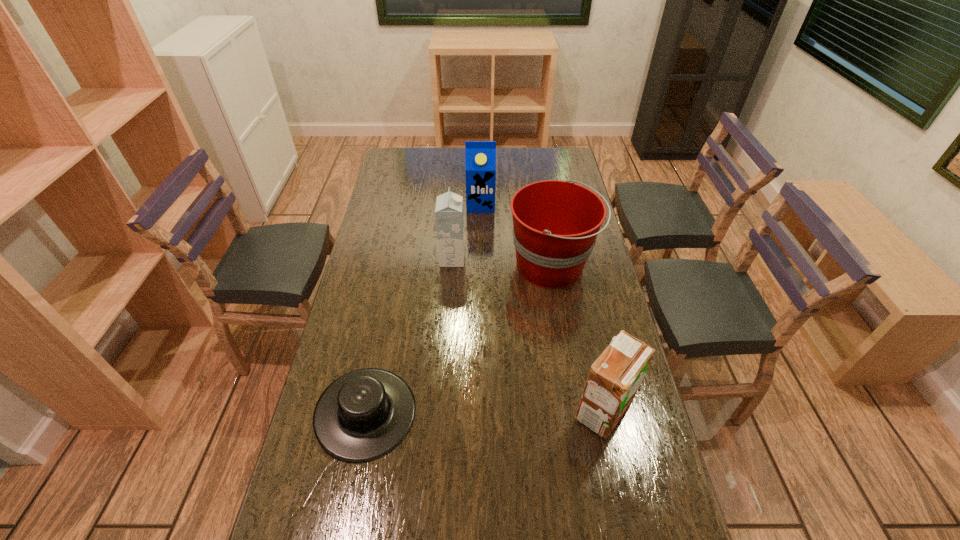
What are the coordinates of `free spot located 0.140m on the left of the bucket` in the screenshot? It's located at (468, 266).

I want to click on vacant space located 0.320m on the straw side of the nearest carton, so click(x=455, y=410).

This screenshot has height=540, width=960. What are the coordinates of `free region located on the straw side of the nearest carton` in the screenshot? It's located at (469, 410).

Where is `vacant space positioned 0.100m on the straw side of the nearest carton`? The width and height of the screenshot is (960, 540). vacant space positioned 0.100m on the straw side of the nearest carton is located at coordinates (537, 410).

The image size is (960, 540). In order to click on blank space located on the right of the shortest object in this screenshot , I will do `click(460, 413)`.

At what (x,y) coordinates should I click in order to perform the action: click on object that is at the left edge. Please return your answer as a coordinate pair (x, y). The width and height of the screenshot is (960, 540). Looking at the image, I should click on (364, 414).

This screenshot has height=540, width=960. What are the coordinates of `bucket that is at the right edge` in the screenshot? It's located at (555, 223).

Where is `carton situated at the right edge`? carton situated at the right edge is located at coordinates (614, 378).

Locate an element on the screen. The width and height of the screenshot is (960, 540). free space at the far edge of the desktop is located at coordinates (496, 158).

In the image, there is a desktop. Where is `vacant area at the left edge`? This screenshot has width=960, height=540. vacant area at the left edge is located at coordinates (387, 220).